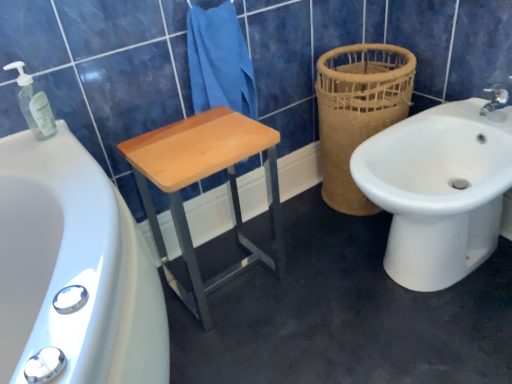
Image resolution: width=512 pixels, height=384 pixels. What are the coordinates of `space that is in front of light wood/matte stool at center` in the screenshot? It's located at (247, 343).